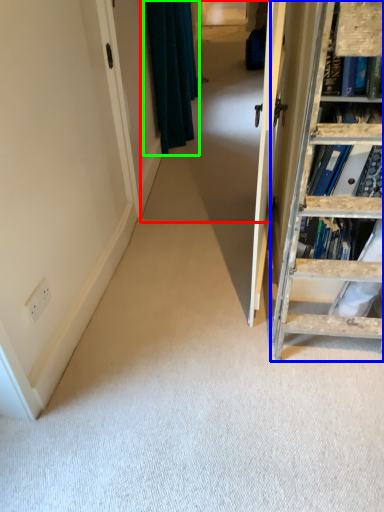
Question: Which object is positioned farthest from passage (highlighted by a red box)? Select from ladder (highlighted by a blue box) and curtain (highlighted by a green box).

Choices:
 (A) ladder
 (B) curtain

Answer: (A)